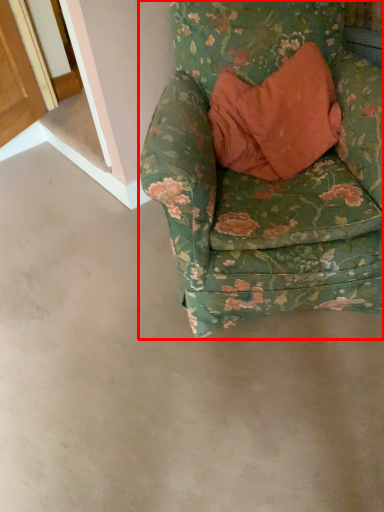
Question: From the image's perspective, what is the correct spatial relationship of chair (annotated by the red box) in relation to concrete?

Choices:
 (A) above
 (B) below

Answer: (A)